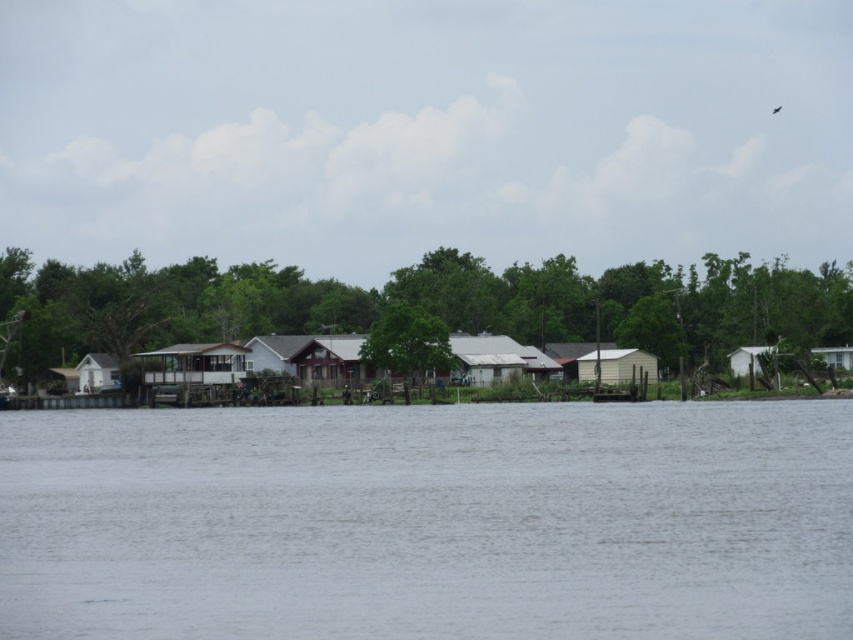
Can you confirm if green leafy tree at center is positioned to the right of white wooden hut at center?

Correct, you'll find green leafy tree at center to the right of white wooden hut at center.

Does green leafy tree at center have a greater height compared to white wooden hut at center?

Yes.

Where is `green leafy tree at center`? green leafy tree at center is located at coordinates (424, 304).

Does green leafy tree at center appear on the right side of white wood house at center?

Indeed, green leafy tree at center is positioned on the right side of white wood house at center.

Is point (850, 337) farther from viewer compared to point (254, 369)?

Yes, it is behind point (254, 369).

This screenshot has width=853, height=640. Find the location of `green leafy tree at center`. green leafy tree at center is located at coordinates (424, 304).

Which is more to the right, white wooden hut at center or metallic silver shed at center-right?

metallic silver shed at center-right

In order to click on white wooden hut at center in this screenshot , I will do `click(194, 364)`.

Is point (250, 352) closer to camera compared to point (646, 353)?

No.

You are a GUI agent. You are given a task and a screenshot of the screen. Output one action in this format:
    pyautogui.click(x=<x>, y=<y>)
    Task: Click on the white wooden hut at center
    This screenshot has width=853, height=640.
    Given the screenshot: What is the action you would take?
    pyautogui.click(x=194, y=364)